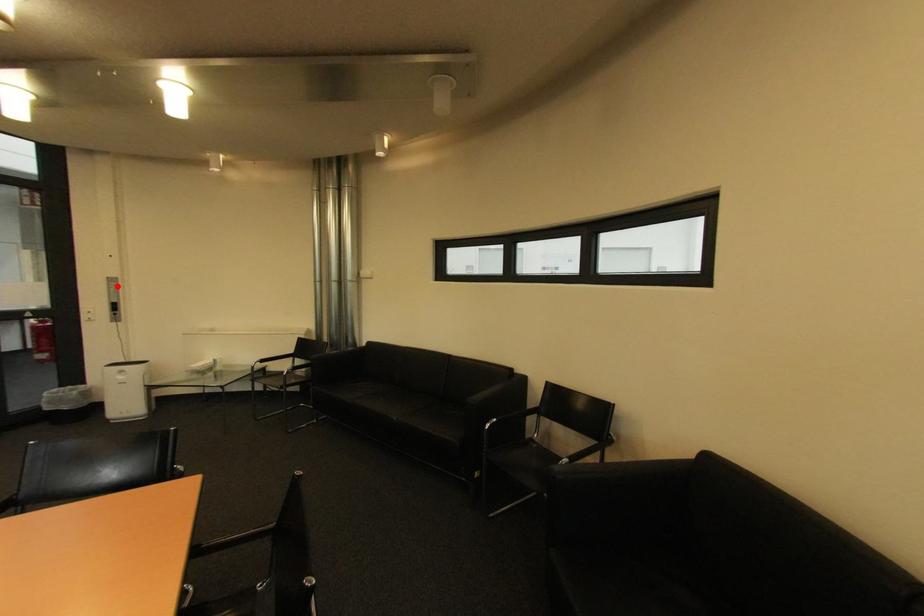
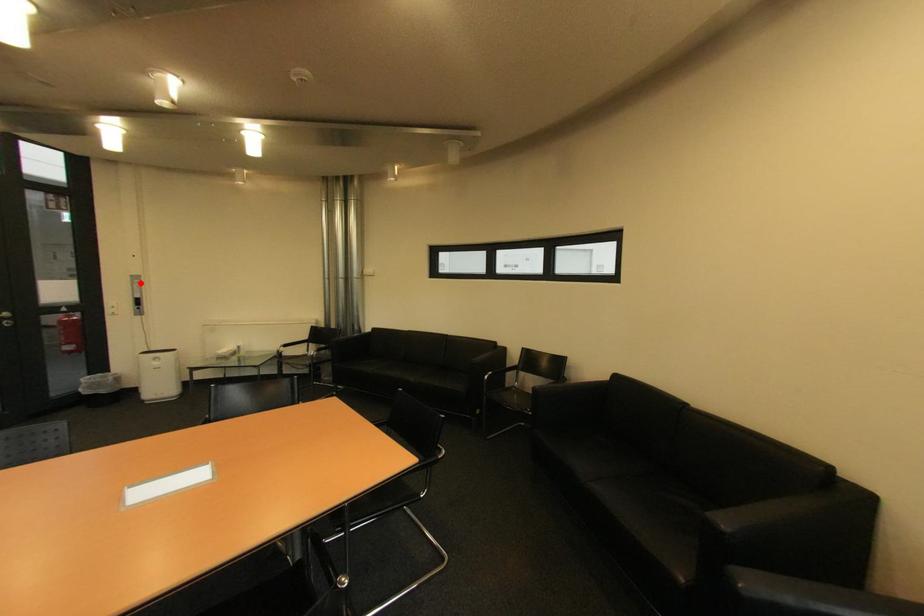
I am providing you with two images of the same scene from different viewpoints. A red point is marked on the first image and another point is marked on the second image. Are the points marked in image1 and image2 representing the same 3D position?

Yes